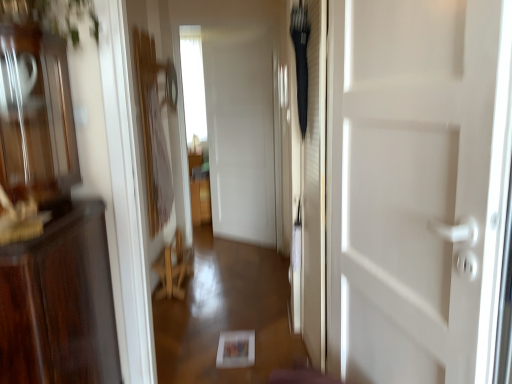
Question: From a real-world perspective, does transparent glass window at center stand above white glossy door at center?

Choices:
 (A) no
 (B) yes

Answer: (B)

Question: Could you tell me if transparent glass window at center is turned towards white glossy door at center?

Choices:
 (A) no
 (B) yes

Answer: (B)

Question: Are transparent glass window at center and white glossy door at center far apart?

Choices:
 (A) no
 (B) yes

Answer: (B)

Question: From the image's perspective, is transparent glass window at center under white glossy door at center?

Choices:
 (A) no
 (B) yes

Answer: (A)

Question: Can you confirm if transparent glass window at center is positioned to the left of white glossy door at center?

Choices:
 (A) yes
 (B) no

Answer: (A)

Question: In terms of height, does wooden chair at center look taller or shorter compared to transparent glass window at center?

Choices:
 (A) short
 (B) tall

Answer: (A)

Question: In the image, is wooden chair at center on the left side or the right side of transparent glass window at center?

Choices:
 (A) right
 (B) left

Answer: (A)

Question: Looking at the image, does wooden chair at center seem bigger or smaller compared to transparent glass window at center?

Choices:
 (A) big
 (B) small

Answer: (B)

Question: Do you think wooden chair at center is within transparent glass window at center, or outside of it?

Choices:
 (A) outside
 (B) inside

Answer: (A)

Question: Looking at their shapes, would you say transparent glass window at center is wider or thinner than wooden chair at center?

Choices:
 (A) wide
 (B) thin

Answer: (A)

Question: Would you say transparent glass window at center is to the left or to the right of wooden chair at center in the picture?

Choices:
 (A) left
 (B) right

Answer: (A)

Question: In terms of size, does transparent glass window at center appear bigger or smaller than wooden chair at center?

Choices:
 (A) small
 (B) big

Answer: (B)

Question: Is point (192, 31) positioned closer to the camera than point (166, 292)?

Choices:
 (A) closer
 (B) farther

Answer: (B)

Question: Would you say white glossy door at center is inside or outside transparent glass window at center?

Choices:
 (A) outside
 (B) inside

Answer: (A)

Question: Based on their sizes in the image, would you say white glossy door at center is bigger or smaller than transparent glass window at center?

Choices:
 (A) small
 (B) big

Answer: (A)